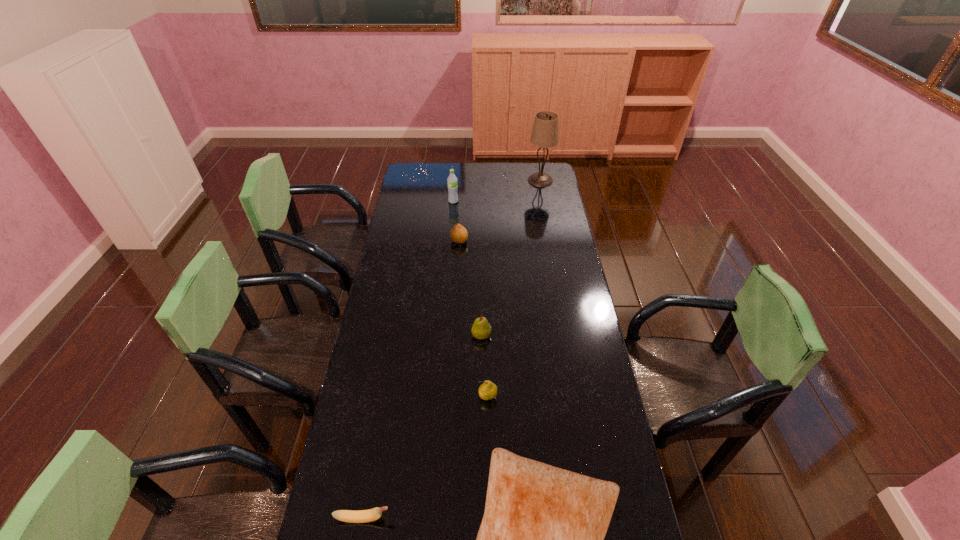
This screenshot has height=540, width=960. In order to click on object present at the far right corner in this screenshot , I will do `click(545, 134)`.

Where is `vacant point at the far edge`? vacant point at the far edge is located at coordinates (475, 167).

In the image, there is a desktop. In order to click on free space at the left edge in this screenshot , I will do `click(404, 187)`.

Where is `vacant space at the right edge`? vacant space at the right edge is located at coordinates (537, 190).

In the image, there is a desktop. Where is `free space at the far left corner`? This screenshot has width=960, height=540. free space at the far left corner is located at coordinates (429, 168).

At what (x,y) coordinates should I click in order to perform the action: click on vacant space at the far right corner of the desktop. Please return your answer as a coordinate pair (x, y). This screenshot has height=540, width=960. Looking at the image, I should click on (551, 173).

Locate an element on the screen. The image size is (960, 540). free point between the lampshade and the nearest pear is located at coordinates (514, 289).

Locate an element on the screen. The width and height of the screenshot is (960, 540). free space between the leftmost object and the lampshade is located at coordinates (452, 349).

Identify the location of free point between the second nearest pear and the banana. Image resolution: width=960 pixels, height=540 pixels. (422, 427).

Where is `free space that is in between the fifth nearest object and the sixth nearest object`? This screenshot has height=540, width=960. free space that is in between the fifth nearest object and the sixth nearest object is located at coordinates click(x=456, y=221).